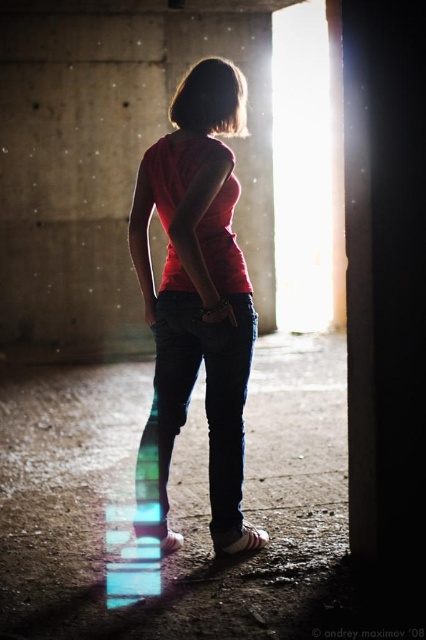
Can you confirm if matte red t-shirt at center is smaller than black denim jeans at center?

Incorrect, matte red t-shirt at center is not smaller in size than black denim jeans at center.

Which is in front, point (140, 260) or point (249, 323)?

Point (249, 323)

Measure the distance between point (163, 499) and camera.

Point (163, 499) and camera are 3.12 meters apart from each other.

The image size is (426, 640). I want to click on matte red t-shirt at center, so click(x=199, y=289).